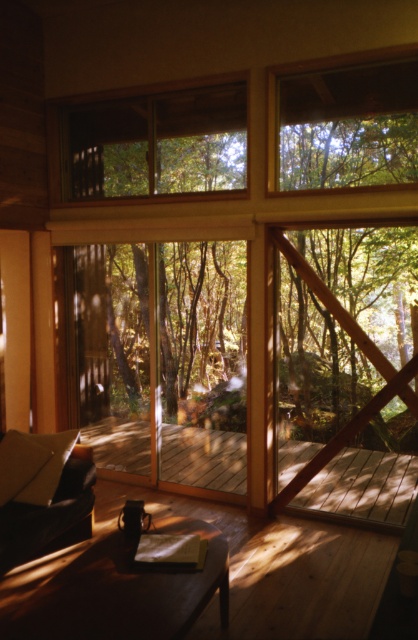
Consider the image. Which is below, clear glass window at upper center or wooden deck at center?

wooden deck at center is lower down.

Is clear glass window at upper center positioned before wooden deck at center?

Yes, it is in front of wooden deck at center.

Between point (139, 170) and point (310, 492), which one is positioned in front?

Point (310, 492) is in front.

Image resolution: width=418 pixels, height=640 pixels. What are the coordinates of `clear glass window at upper center` in the screenshot? It's located at (155, 144).